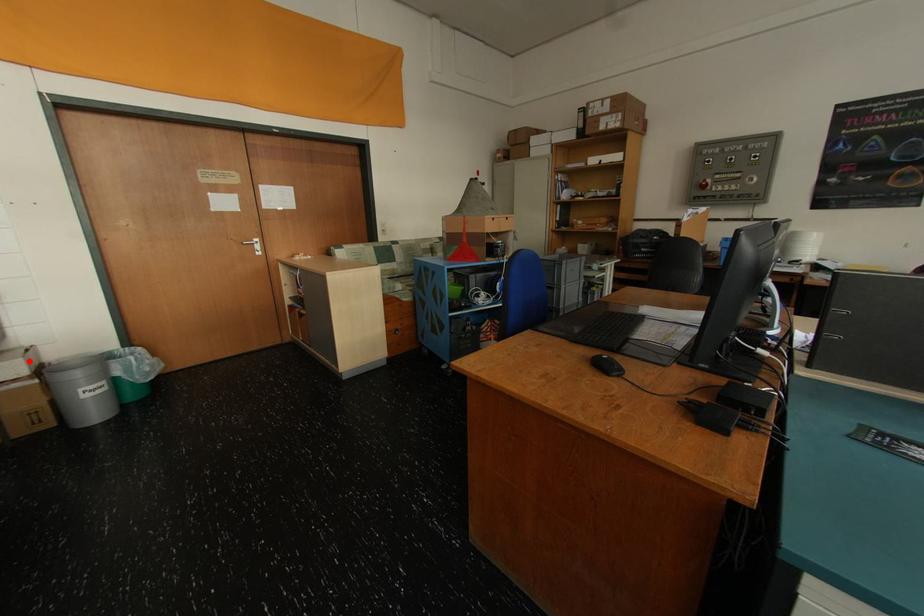
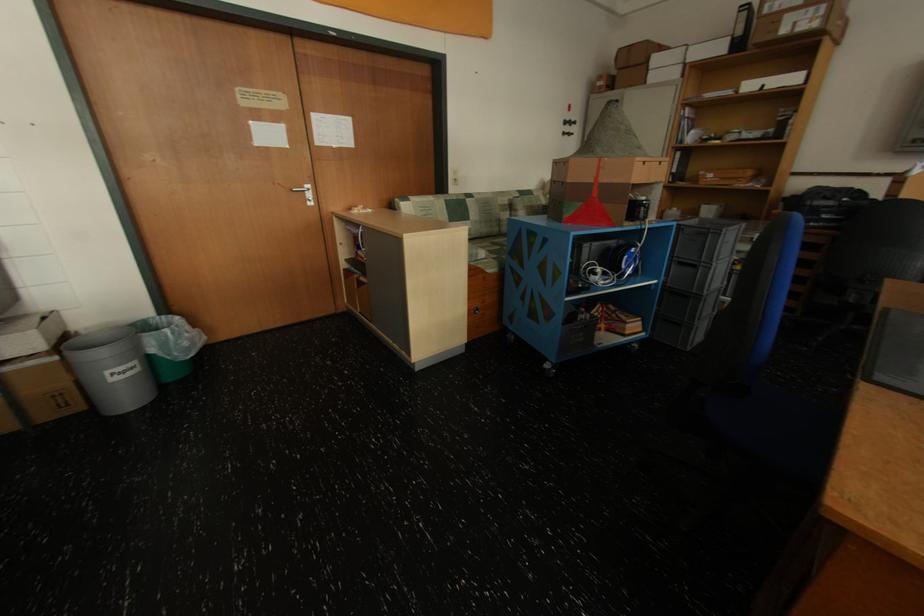
In the second image, find the point that corresponds to the highlighted location in the first image.

(43, 333)